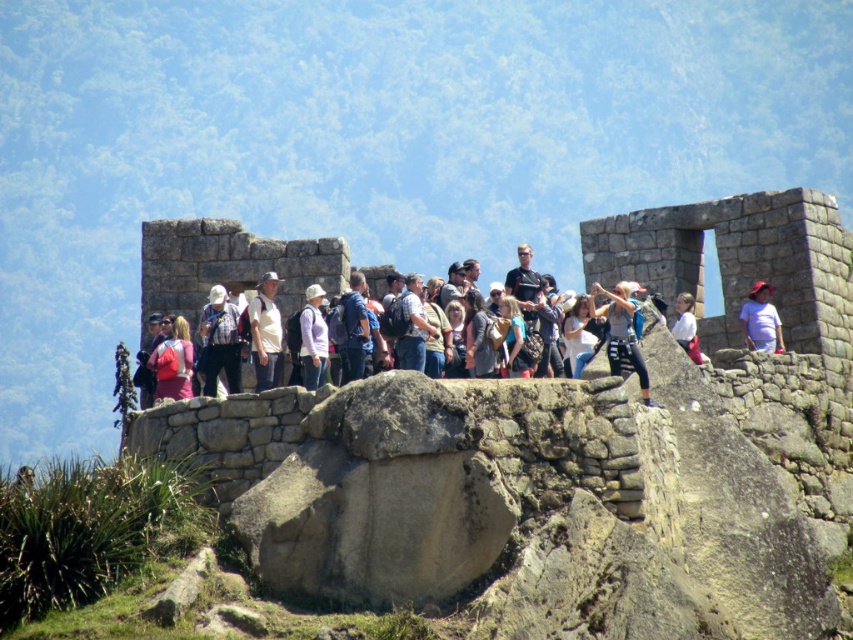
Looking at this image, measure the distance from white cotton shirt at upper right to white cotton shirt at center.

white cotton shirt at upper right and white cotton shirt at center are 3.69 meters apart.

Is point (778, 328) positioned in front of point (680, 346)?

That is False.

You are a GUI agent. You are given a task and a screenshot of the screen. Output one action in this format:
    pyautogui.click(x=<x>, y=<y>)
    Task: Click on the white cotton shirt at upper right
    The image size is (853, 640).
    Given the screenshot: What is the action you would take?
    pyautogui.click(x=759, y=321)

What do you see at coordinates (219, 342) in the screenshot?
I see `plaid shirt at center` at bounding box center [219, 342].

Is point (222, 296) behind point (686, 301)?

No, (222, 296) is in front of (686, 301).

The image size is (853, 640). In order to click on plaid shirt at center in this screenshot , I will do `click(219, 342)`.

Can you confirm if plaid shirt at center is positioned to the right of matte white shirt at center?

In fact, plaid shirt at center is to the left of matte white shirt at center.

Does plaid shirt at center have a greater height compared to matte white shirt at center?

Yes.

Between point (207, 355) and point (305, 292), which one is positioned in front?

Point (207, 355) is in front.

At what (x,y) coordinates should I click in order to perform the action: click on plaid shirt at center. Please return your answer as a coordinate pair (x, y). Looking at the image, I should click on (219, 342).